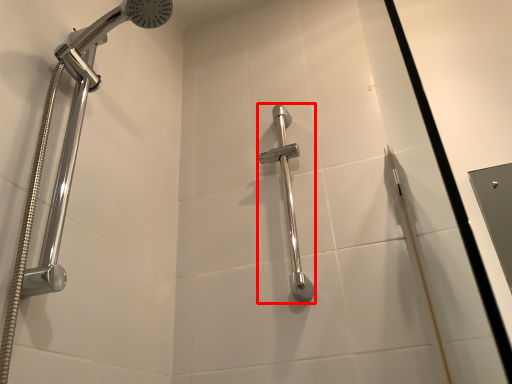
Question: From the image, what is the correct spatial relationship of shower (annotated by the red box) in relation to shower?

Choices:
 (A) right
 (B) left

Answer: (A)